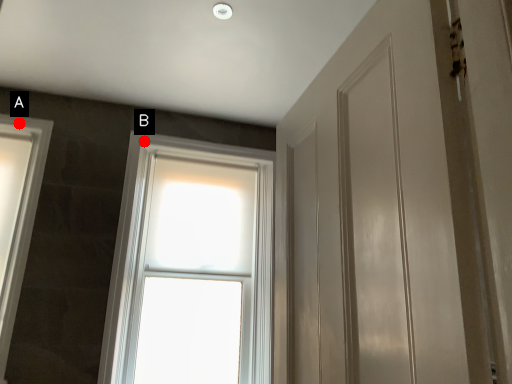
Question: Two points are circled on the image, labeled by A and B beside each circle. Which point appears closest to the camera in this image?

Choices:
 (A) A is closer
 (B) B is closer

Answer: (A)